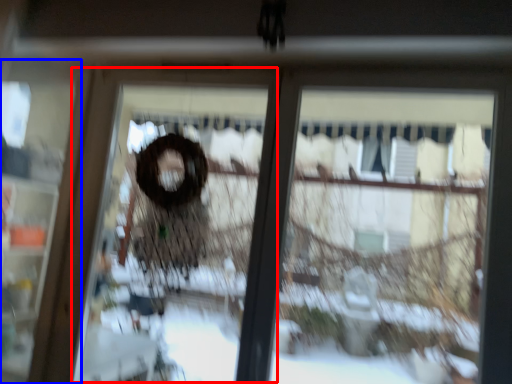
Question: Which object is further to the camera taking this photo, screen door (highlighted by a red box) or screen door (highlighted by a blue box)?

Choices:
 (A) screen door
 (B) screen door

Answer: (B)